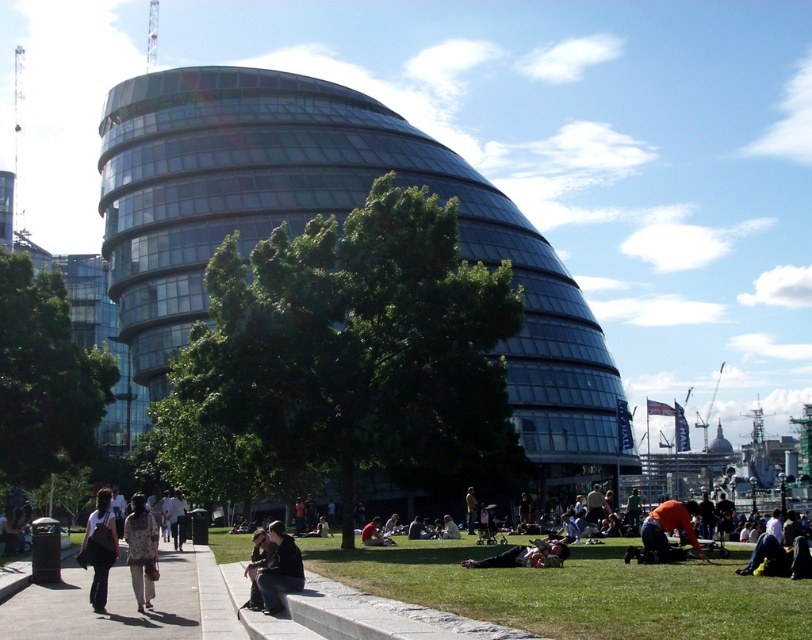
Can you confirm if orange fabric at lower right is positioned to the right of dark brown leather jacket at lower center?

Yes, orange fabric at lower right is to the right of dark brown leather jacket at lower center.

Between point (694, 547) and point (374, 524), which one is positioned behind?

The point (374, 524) is more distant.

Where is `orange fabric at lower right`? Image resolution: width=812 pixels, height=640 pixels. orange fabric at lower right is located at coordinates (668, 528).

The width and height of the screenshot is (812, 640). In order to click on orange fabric at lower right in this screenshot , I will do `click(668, 528)`.

Which is below, green grass at lower center or concrete sidewalk at lower left?

green grass at lower center

Is green grass at lower center wider than concrete sidewalk at lower left?

Yes, green grass at lower center is wider than concrete sidewalk at lower left.

Where is `green grass at lower center`? green grass at lower center is located at coordinates (577, 589).

Locate an element on the screen. The height and width of the screenshot is (640, 812). green grass at lower center is located at coordinates (577, 589).

Where is `matte black jacket at lower left`? matte black jacket at lower left is located at coordinates (100, 547).

Which is more to the left, matte black jacket at lower left or dark gray fabric jacket at lower center?

From the viewer's perspective, matte black jacket at lower left appears more on the left side.

Where is `matte black jacket at lower left`? matte black jacket at lower left is located at coordinates (100, 547).